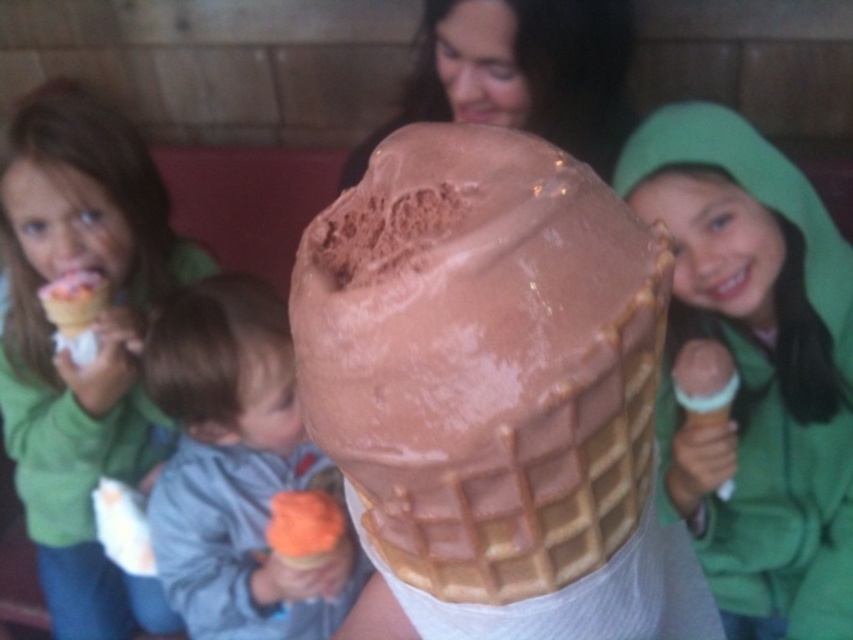
Can you confirm if chocolate matte ice cream cone at center is shorter than orange waffle cone at lower left?

Yes, chocolate matte ice cream cone at center is shorter than orange waffle cone at lower left.

Is chocolate matte ice cream cone at center to the left of orange waffle cone at lower left from the viewer's perspective?

In fact, chocolate matte ice cream cone at center is to the right of orange waffle cone at lower left.

Who is more distant from viewer, (440,164) or (212,593)?

Positioned behind is point (212,593).

Identify the location of chocolate matte ice cream cone at center. The image size is (853, 640). (483, 358).

Looking at this image, which is more to the left, matte green hoodie at left or orange waffle cone at lower left?

Positioned to the left is matte green hoodie at left.

Can you confirm if matte green hoodie at left is taller than orange waffle cone at lower left?

Indeed, matte green hoodie at left has a greater height compared to orange waffle cone at lower left.

Who is more distant from viewer, (184,244) or (173,596)?

The point (184,244) is more distant.

The image size is (853, 640). In order to click on matte green hoodie at left in this screenshot , I will do `click(97, 346)`.

The width and height of the screenshot is (853, 640). I want to click on chocolate matte ice cream cone at center, so click(483, 358).

Which is below, chocolate matte ice cream cone at center or matte green hoodie at left?

Positioned lower is matte green hoodie at left.

Which is in front, point (392, 141) or point (57, 170)?

Point (392, 141) is in front.

The height and width of the screenshot is (640, 853). What are the coordinates of `chocolate matte ice cream cone at center` in the screenshot? It's located at (483, 358).